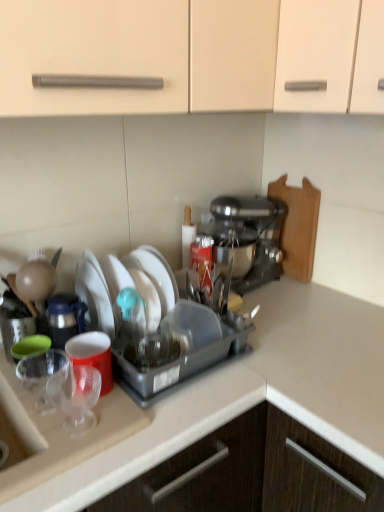
Image resolution: width=384 pixels, height=512 pixels. In order to click on vacant space to the right of transparent plastic cup at lower left, which ranks as the 1th tableware in front-to-back order in this screenshot , I will do `click(118, 420)`.